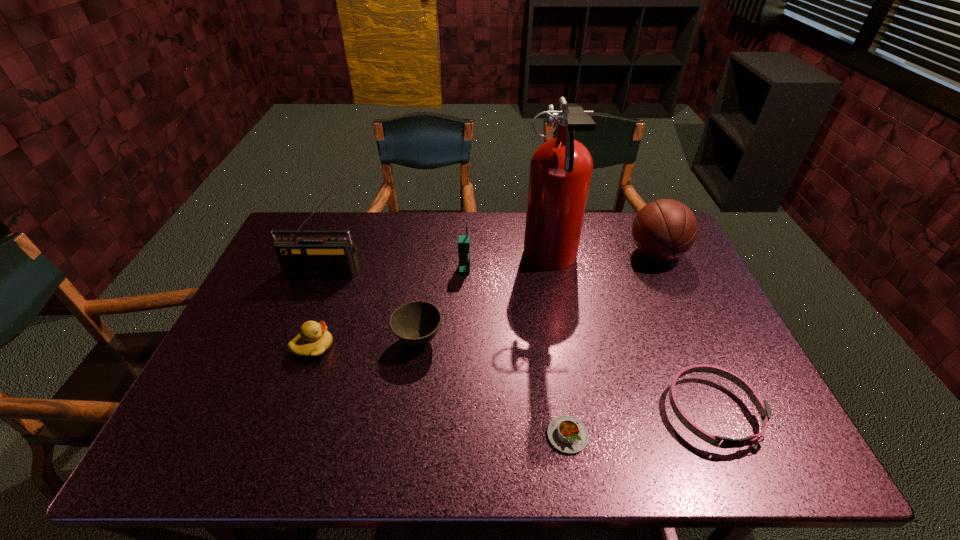
Where is `object that stands as the second closest to the third object from left to right`? Image resolution: width=960 pixels, height=540 pixels. object that stands as the second closest to the third object from left to right is located at coordinates (463, 240).

Identify the location of the third closest object to the cellular telephone. The width and height of the screenshot is (960, 540). [x=300, y=257].

Locate an element on the screen. free space that satisfies the following two spatial constraints: 1. on the keypad of the fourth object from left to right; 2. on the beak of the duckling is located at coordinates (462, 347).

Where is `free space that satisfies the following two spatial constraints: 1. on the back side of the tallest object; 2. on the right side of the shortest object`? This screenshot has width=960, height=540. free space that satisfies the following two spatial constraints: 1. on the back side of the tallest object; 2. on the right side of the shortest object is located at coordinates (540, 260).

At what (x,y) coordinates should I click in order to perform the action: click on free space that satisfies the following two spatial constraints: 1. on the keypad of the fifth object from right to left; 2. on the right side of the pudding. Please return your answer as a coordinate pair (x, y). Looking at the image, I should click on (458, 435).

I want to click on vacant space that satisfies the following two spatial constraints: 1. on the keypad of the fourth object from left to right; 2. on the beak of the duckling, so click(x=462, y=347).

This screenshot has width=960, height=540. Find the location of `free space that satisfies the following two spatial constraints: 1. on the front-facing side of the seventh shortest object; 2. on the right side of the shortest object`. free space that satisfies the following two spatial constraints: 1. on the front-facing side of the seventh shortest object; 2. on the right side of the shortest object is located at coordinates (262, 435).

Locate an element on the screen. This screenshot has height=540, width=960. free space that satisfies the following two spatial constraints: 1. on the keypad of the fifth object from right to left; 2. on the right side of the pudding is located at coordinates (458, 435).

You are a GUI agent. You are given a task and a screenshot of the screen. Output one action in this format:
    pyautogui.click(x=<x>, y=<y>)
    Task: Click on the vacant space that satisfies the following two spatial constraints: 1. on the keypad of the cellular telephone; 2. on the beak of the duckling
    Image resolution: width=960 pixels, height=540 pixels.
    Given the screenshot: What is the action you would take?
    pyautogui.click(x=462, y=347)